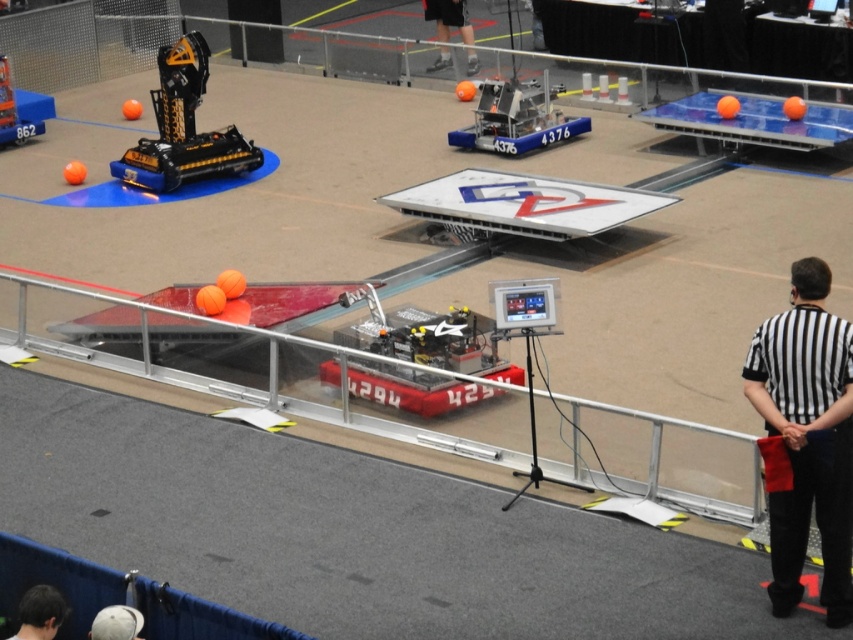
Question: Among these objects, which one is farthest from the camera?

Choices:
 (A) black striped shirt at right
 (B) black plastic robot at upper left

Answer: (B)

Question: Which point is closer to the camera?

Choices:
 (A) black striped shirt at right
 (B) metallic blue robot at center
 (C) dark brown hair at lower left
 (D) black plastic robot at upper left

Answer: (C)

Question: Can you confirm if black striped shirt at right is positioned to the left of black plastic robot at upper left?

Choices:
 (A) yes
 (B) no

Answer: (B)

Question: Does black striped shirt at right have a lesser width compared to dark brown hair at lower left?

Choices:
 (A) yes
 (B) no

Answer: (B)

Question: Among these objects, which one is nearest to the camera?

Choices:
 (A) black plastic robot at upper left
 (B) black striped shirt at right
 (C) black fabric pants at upper center
 (D) metallic blue robot at center

Answer: (B)

Question: Is dark brown hair at lower left to the right of black fabric pants at upper center from the viewer's perspective?

Choices:
 (A) yes
 (B) no

Answer: (B)